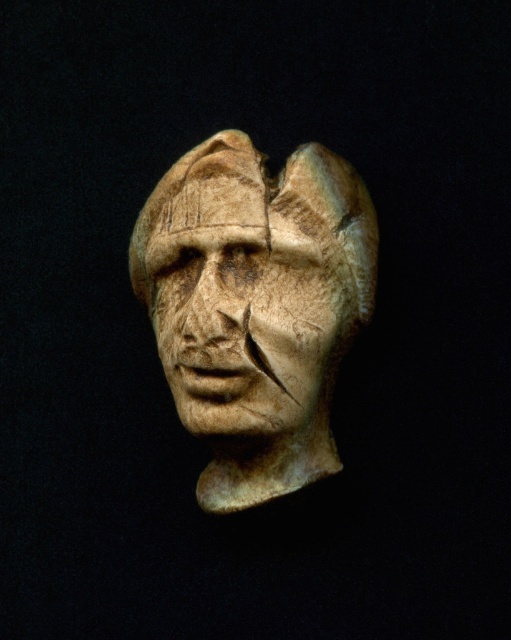
Question: Among these points, which one is nearest to the camera?

Choices:
 (A) (142, 278)
 (B) (249, 349)

Answer: (B)

Question: Which of the following is the farthest from the observer?

Choices:
 (A) (355, 252)
 (B) (243, 284)

Answer: (A)

Question: Is beige stone head at center thinner than carved stone face at center?

Choices:
 (A) yes
 (B) no

Answer: (B)

Question: Can you confirm if beige stone head at center is positioned to the left of carved stone face at center?

Choices:
 (A) yes
 (B) no

Answer: (B)

Question: Is beige stone head at center to the left of carved stone face at center from the viewer's perspective?

Choices:
 (A) no
 (B) yes

Answer: (A)

Question: Which of the following is the farthest from the observer?

Choices:
 (A) carved stone face at center
 (B) beige stone head at center

Answer: (A)